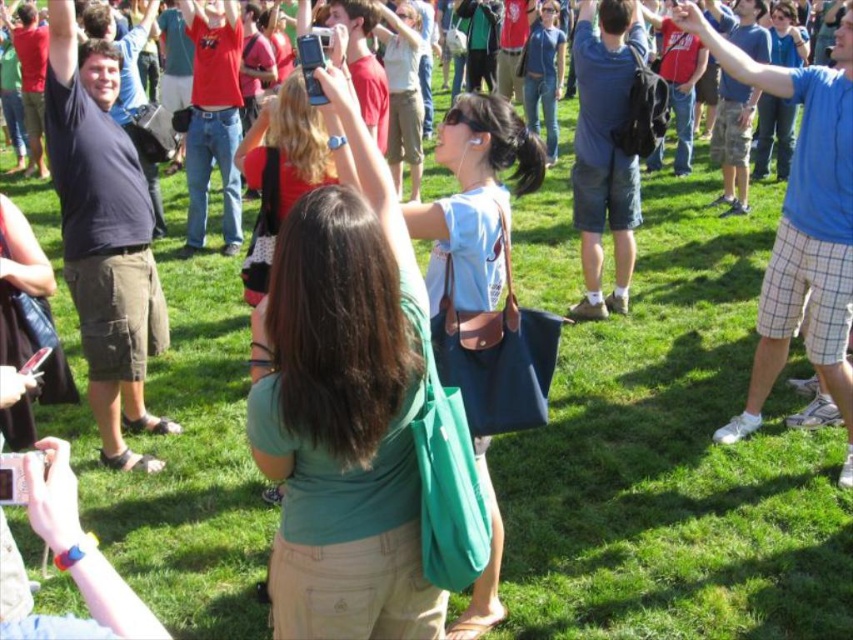
You are organizing a photo shoot and need to arrange two models wearing the dark blue shirt at left and blue plaid shorts at right. Based on their sizes, which model should you place in the foreground to ensure they are clearly visible in the photo?

The dark blue shirt at left is smaller than the blue plaid shorts at right, so placing the model wearing the dark blue shirt at left in the foreground will ensure they are clearly visible since smaller objects are better seen when closer to the camera.

You are standing at the center of the grassy field and want to locate the matte green bag at center. According to the coordinates provided, in which direction should you move to find it?

The matte green bag at center is located at coordinates point 0.630 on the x axis and 0.403 on the y axis. Since you are at the center, moving towards the right and slightly forward would align with the bag at point (x=343, y=403).